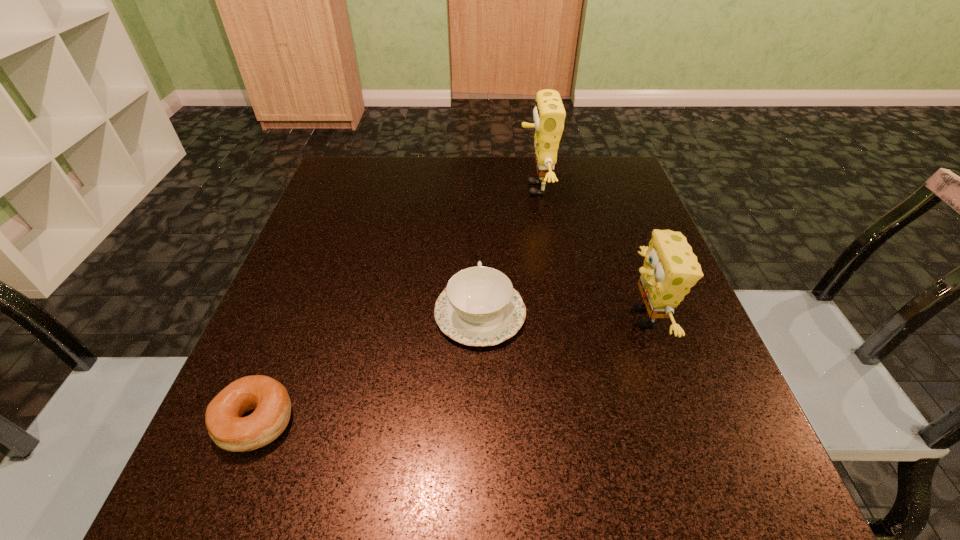
This screenshot has height=540, width=960. Find the location of `vacant point located between the second tallest object and the leftmost object`. vacant point located between the second tallest object and the leftmost object is located at coordinates (x=450, y=369).

Where is `vacant space that is in between the third shortest object and the third object from right to left`? vacant space that is in between the third shortest object and the third object from right to left is located at coordinates (563, 316).

Identify the location of free point between the farther sponge and the shortest object. The width and height of the screenshot is (960, 540). (395, 305).

Locate an element on the screen. This screenshot has width=960, height=540. unoccupied position between the farthest object and the chinaware is located at coordinates (508, 251).

I want to click on vacant space in between the nearest object and the third object from left to right, so click(x=395, y=305).

This screenshot has height=540, width=960. In order to click on vacant space that's between the third tallest object and the farther sponge in this screenshot , I will do `click(508, 251)`.

Find the location of a particular element. free space between the second shortest object and the left sponge is located at coordinates (508, 251).

The height and width of the screenshot is (540, 960). Identify the location of vacant space that is in between the nearer sponge and the bagel. (450, 369).

Find the location of `free space that is in between the leftmost object and the left sponge`. free space that is in between the leftmost object and the left sponge is located at coordinates (395, 305).

This screenshot has width=960, height=540. Identify the location of free point between the third tallest object and the tallest object. (508, 251).